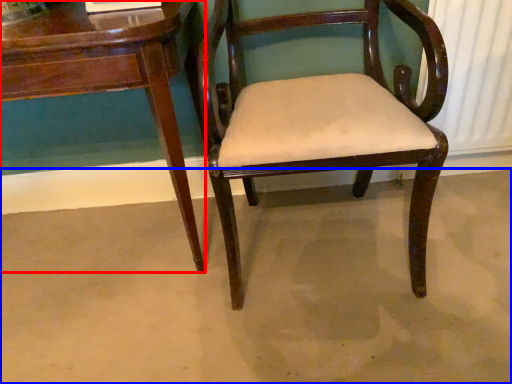
Question: Among these objects, which one is farthest to the camera, table (highlighted by a red box) or concrete (highlighted by a blue box)?

Choices:
 (A) table
 (B) concrete

Answer: (B)